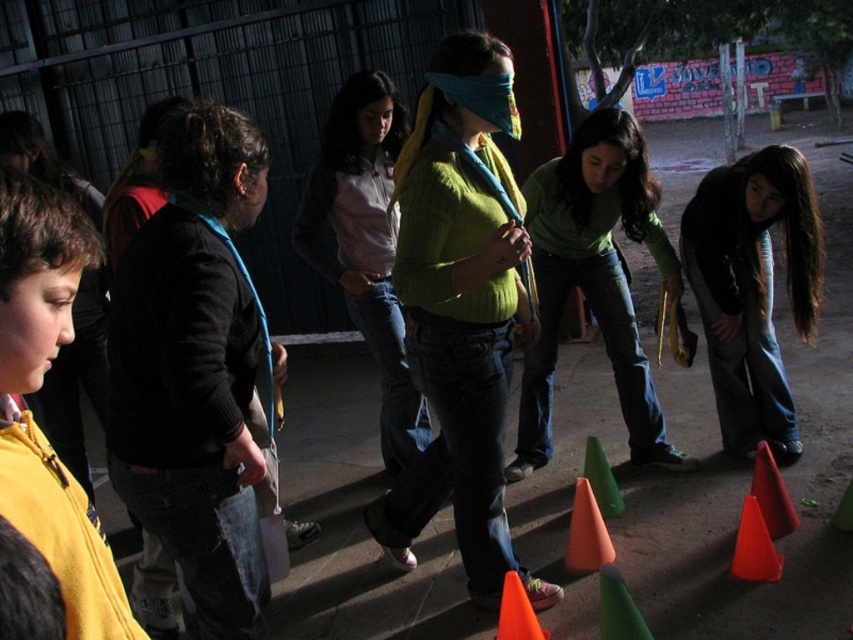
Looking at this image, you are a participant in a blindfolded obstacle course and need to move from the orange matte traffic cone at lower center to the smooth red traffic cone at lower right. Can you safely step over the gap between them?

The orange matte traffic cone at lower center is positioned under the smooth red traffic cone at lower right, meaning there is no gap between them for you to step over. You can safely move directly to the smooth red traffic cone at lower right without needing to step over any gap.

You are a participant in the activity and need to reach the green matte traffic cone at center without touching it. You are currently standing near the dark blue jeans at lower right. Which direction should you move to get closer to the cone?

Since the dark blue jeans at lower right is in front of the green matte traffic cone at center, you should move backward away from the dark blue jeans at lower right to get closer to the cone.

You are a participant in the blindfolded activity and need to identify which traffic cone is thinner. You can only touch the orange matte traffic cone at lower center and the smooth red traffic cone at lower right. Which one should you choose?

The orange matte traffic cone at lower center is thinner than the smooth red traffic cone at lower right, so you should choose the orange matte traffic cone at lower center.